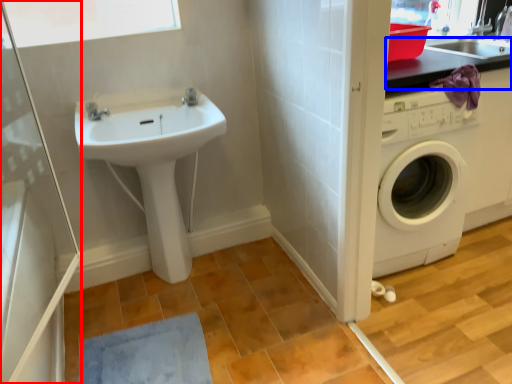
Question: Which object is closer to the camera taking this photo, screen door (highlighted by a red box) or counter top (highlighted by a blue box)?

Choices:
 (A) screen door
 (B) counter top

Answer: (A)